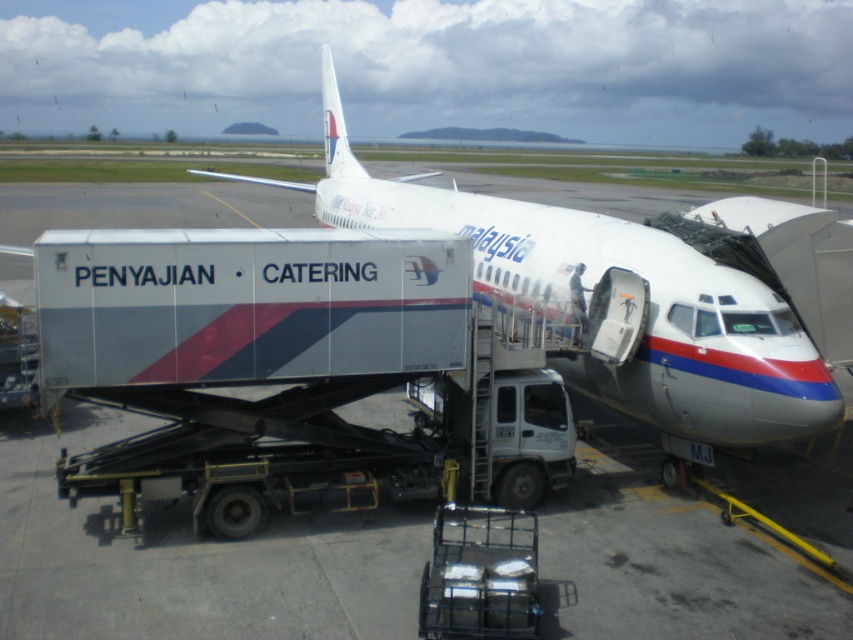
Based on the photo, you are a ground crew member who needs to park another vehicle behind the white glossy catering truck at center. Considering the space available, will the white glossy airplane at center interfere with the parking process?

The white glossy catering truck at center occupies less space than the white glossy airplane at center. Therefore, the airplane may still block the parking area, so the ground crew member should check the available space behind the catering truck to ensure there is enough room without interference from the airplane.

You are a passenger standing at the gate where the Malaysia Airlines aircraft is parked. You notice a point marked at coordinates (x=189, y=573). What object is located at this point?

The point at coordinates (x=189, y=573) marks the white glossy catering truck at center.

You are a delivery driver who needs to unload food supplies from the white glossy catering truck at center to the white glossy airplane at center. The truck has a ramp that can extend 10 meters. Will the ramp be long enough to reach the airplane?

The white glossy catering truck at center is 11.07 meters from the white glossy airplane at center. Since the ramp can only extend 10 meters, it is not long enough to reach the airplane.